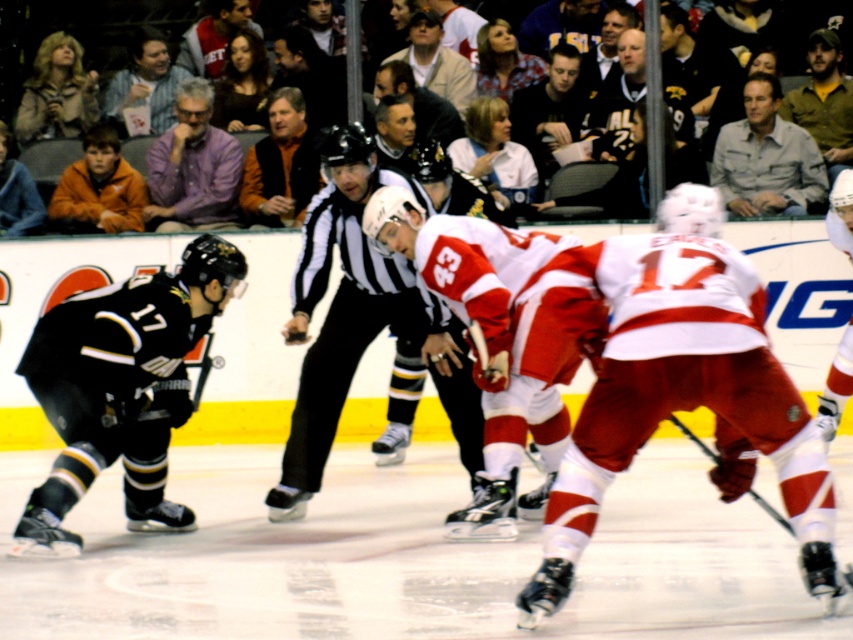
Question: Does khaki shirt at upper right have a greater width compared to orange fleece jacket at upper left?

Choices:
 (A) no
 (B) yes

Answer: (B)

Question: Which of the following is the farthest from the observer?

Choices:
 (A) purple shirt at upper center
 (B) white matte jersey at center
 (C) smooth black helmet at center
 (D) orange fleece jacket at upper left

Answer: (D)

Question: Can you confirm if red matte jersey at center is wider than orange fleece jacket at upper left?

Choices:
 (A) yes
 (B) no

Answer: (A)

Question: Observing the image, what is the correct spatial positioning of black jersey at center in reference to brown leather jacket at upper right?

Choices:
 (A) below
 (B) above

Answer: (B)

Question: Which of the following is the farthest from the observer?

Choices:
 (A) (627, 38)
 (B) (556, 90)
 (C) (722, 358)

Answer: (A)

Question: Which object is closer to the camera taking this photo?

Choices:
 (A) striped shirt at upper center
 (B) purple shirt at upper center
 (C) khaki shirt at upper right
 (D) orange fleece jacket at upper left

Answer: (C)